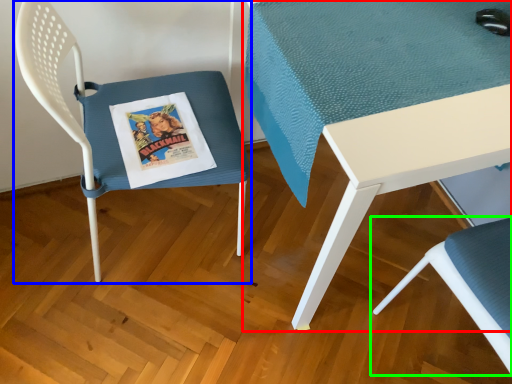
Question: Which object is the closest to the table (highlighted by a red box)? Choose among these: chair (highlighted by a blue box) or chair (highlighted by a green box).

Choices:
 (A) chair
 (B) chair

Answer: (A)